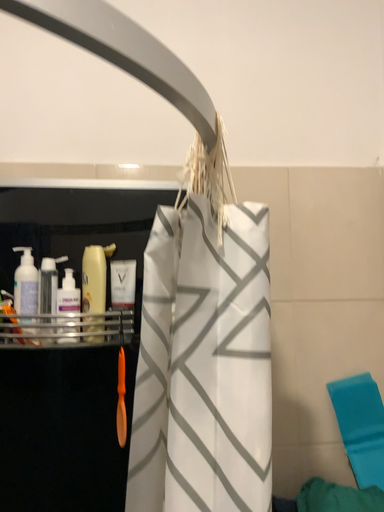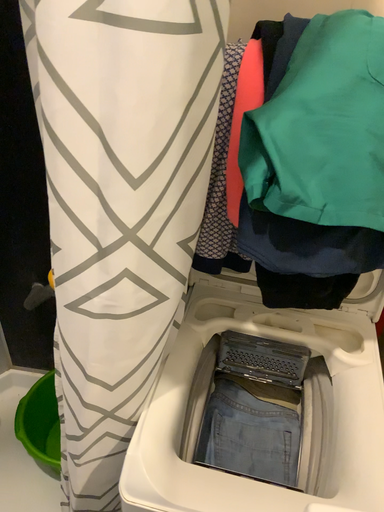
Question: Which way did the camera rotate in the video?

Choices:
 (A) rotated downward
 (B) rotated upward

Answer: (A)